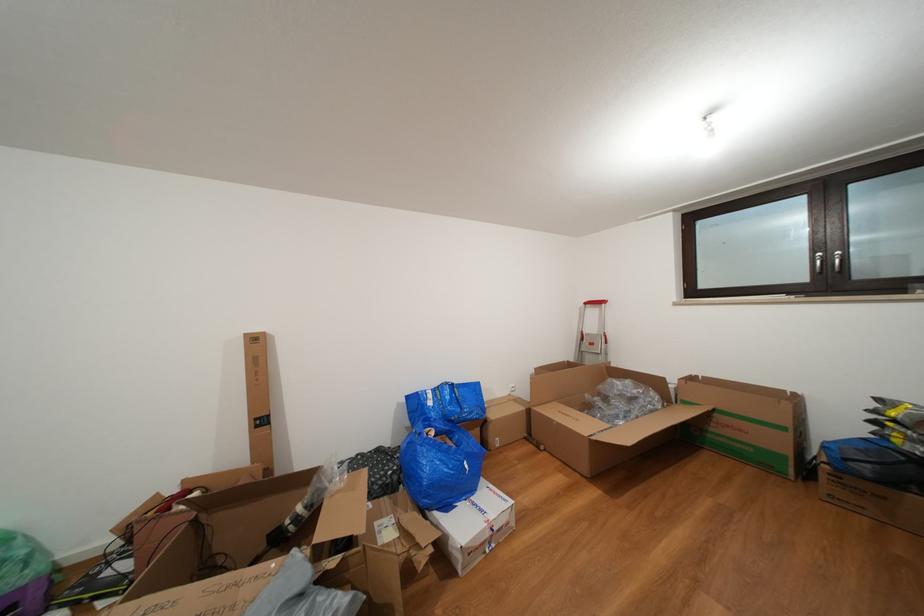
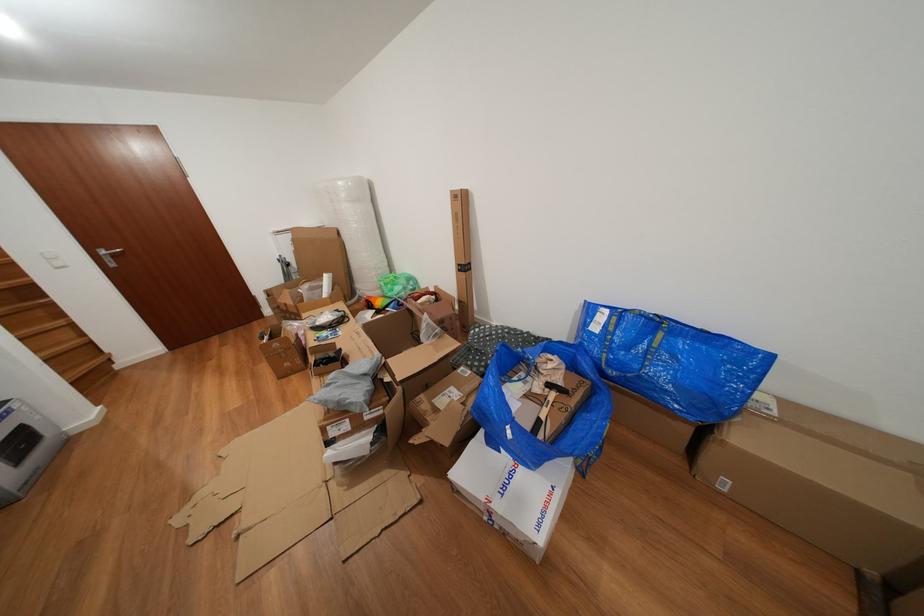
Where in the second image is the point corresponding to (x=489, y=516) from the first image?

(513, 493)